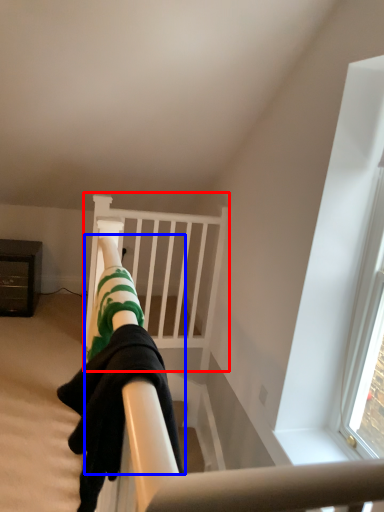
Question: Which object appears farthest to the camera in this image, bunk bed (highlighted by a red box) or person (highlighted by a blue box)?

Choices:
 (A) bunk bed
 (B) person

Answer: (A)